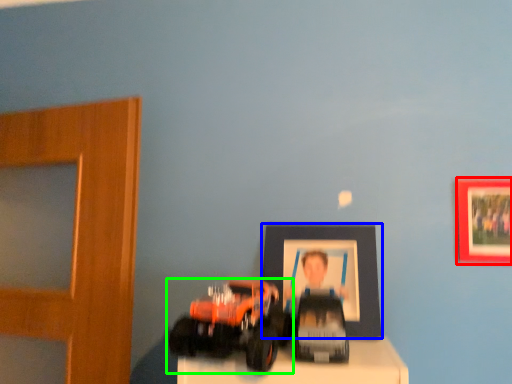
Question: Considering the real-world distances, which object is farthest from picture frame (highlighted by a red box)? picture frame (highlighted by a blue box) or toy (highlighted by a green box)?

Choices:
 (A) picture frame
 (B) toy

Answer: (B)